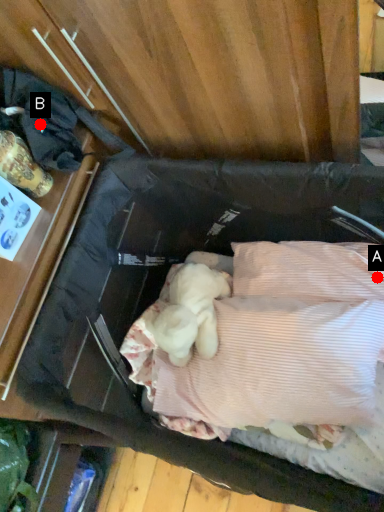
Question: Two points are circled on the image, labeled by A and B beside each circle. Which point is farther to the camera?

Choices:
 (A) A is further
 (B) B is further

Answer: (A)